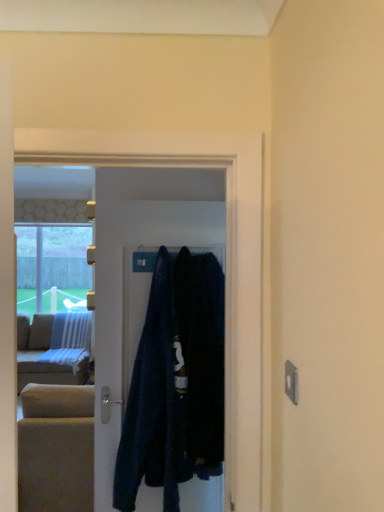
Question: Can you confirm if dark blue fabric coat at center, positioned as the first clothing in right-to-left order, is wider than dark blue fabric at center, the 1th clothing viewed from the left?

Choices:
 (A) yes
 (B) no

Answer: (A)

Question: Are dark blue fabric coat at center, positioned as the 2th clothing in left-to-right order, and dark blue fabric at center, the 2th clothing in the right-to-left sequence, beside each other?

Choices:
 (A) yes
 (B) no

Answer: (B)

Question: From a real-world perspective, does dark blue fabric coat at center, positioned as the first clothing in right-to-left order, stand above dark blue fabric at center, the 2th clothing in the right-to-left sequence?

Choices:
 (A) yes
 (B) no

Answer: (A)

Question: Is dark blue fabric coat at center, positioned as the first clothing in right-to-left order, at the right side of dark blue fabric at center, the 1th clothing viewed from the left?

Choices:
 (A) yes
 (B) no

Answer: (A)

Question: Considering the relative positions of dark blue fabric coat at center, positioned as the 2th clothing in left-to-right order, and dark blue fabric at center, the 2th clothing in the right-to-left sequence, in the image provided, is dark blue fabric coat at center, positioned as the 2th clothing in left-to-right order, to the left of dark blue fabric at center, the 2th clothing in the right-to-left sequence, from the viewer's perspective?

Choices:
 (A) no
 (B) yes

Answer: (A)

Question: Is dark blue fabric coat at center, positioned as the 2th clothing in left-to-right order, oriented towards dark blue fabric at center, the 2th clothing in the right-to-left sequence?

Choices:
 (A) yes
 (B) no

Answer: (B)

Question: Is dark blue fabric coat at center, positioned as the first clothing in right-to-left order, located outside dark blue fabric at center?

Choices:
 (A) no
 (B) yes

Answer: (B)

Question: Considering the relative positions of dark blue fabric coat at center, positioned as the first clothing in right-to-left order, and dark blue fabric at center in the image provided, is dark blue fabric coat at center, positioned as the first clothing in right-to-left order, behind dark blue fabric at center?

Choices:
 (A) yes
 (B) no

Answer: (B)

Question: Considering the relative sizes of dark blue fabric coat at center, positioned as the 2th clothing in left-to-right order, and dark blue fabric at center in the image provided, is dark blue fabric coat at center, positioned as the 2th clothing in left-to-right order, bigger than dark blue fabric at center?

Choices:
 (A) no
 (B) yes

Answer: (B)

Question: Can you confirm if dark blue fabric coat at center, positioned as the first clothing in right-to-left order, is taller than dark blue fabric at center?

Choices:
 (A) no
 (B) yes

Answer: (A)

Question: Is dark blue fabric coat at center, positioned as the 2th clothing in left-to-right order, closer to camera compared to dark blue fabric at center?

Choices:
 (A) no
 (B) yes

Answer: (B)

Question: From the image's perspective, is dark blue fabric coat at center, positioned as the 2th clothing in left-to-right order, beneath dark blue fabric at center?

Choices:
 (A) yes
 (B) no

Answer: (A)

Question: Is dark blue fabric at center, the 1th clothing viewed from the left, shorter than dark blue fabric at center?

Choices:
 (A) yes
 (B) no

Answer: (A)